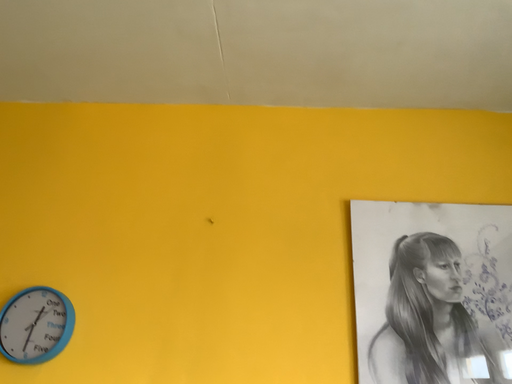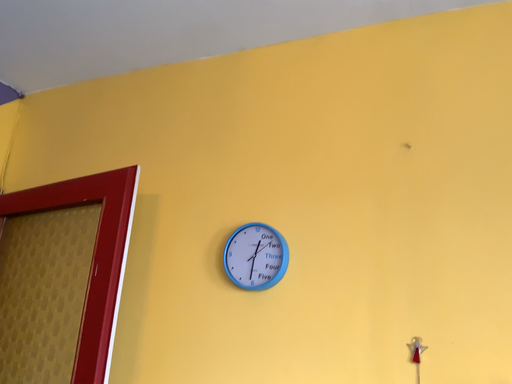
Question: How did the camera likely rotate when shooting the video?

Choices:
 (A) rotated upward
 (B) rotated downward

Answer: (B)